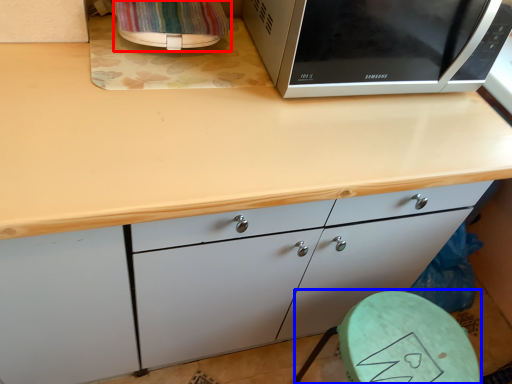
Question: Among these objects, which one is nearest to the camera, appliance (highlighted by a red box) or round table (highlighted by a blue box)?

Choices:
 (A) appliance
 (B) round table

Answer: (A)